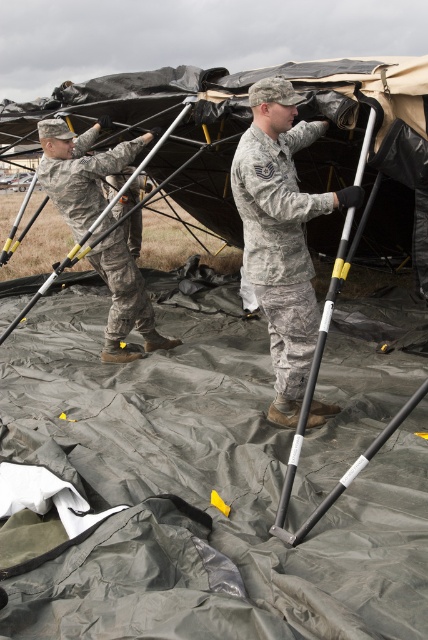
Between camouflage fabric uniform at center and camouflage fabric uniform at left, which one appears on the right side from the viewer's perspective?

From the viewer's perspective, camouflage fabric uniform at center appears more on the right side.

Is camouflage fabric uniform at center positioned behind camouflage fabric uniform at left?

No, it is not.

Is point (306, 204) less distant than point (130, 253)?

Yes, it is.

Where is `camouflage fabric uniform at center`? camouflage fabric uniform at center is located at coordinates (282, 234).